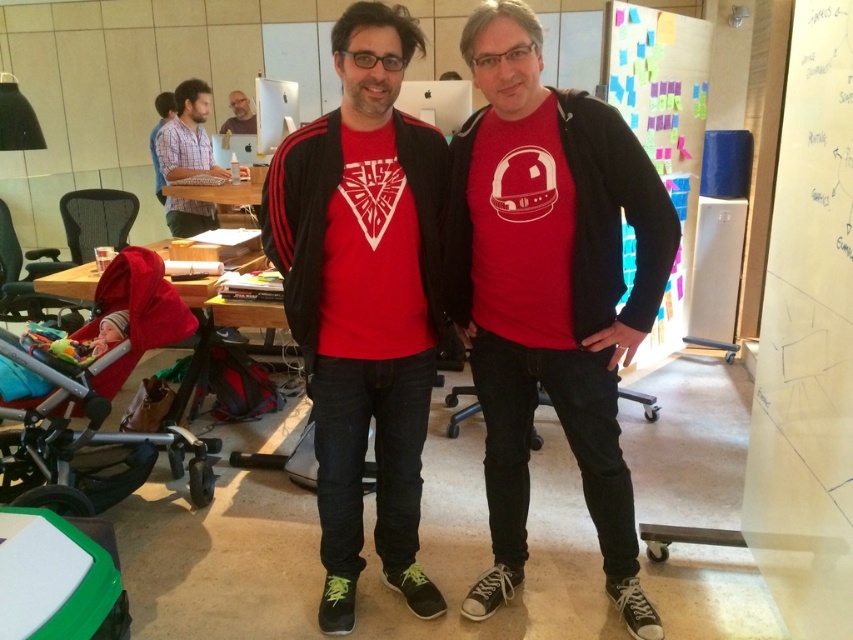
Question: Which point is closer to the camera taking this photo?

Choices:
 (A) (247, 106)
 (B) (331, 401)

Answer: (B)

Question: Is matte blue shirt at upper left below matte black laptop at upper left?

Choices:
 (A) yes
 (B) no

Answer: (A)

Question: Is matte blue shirt at upper left below matte black laptop at upper left?

Choices:
 (A) no
 (B) yes

Answer: (B)

Question: Can you confirm if matte blue shirt at upper left is wider than matte black laptop at upper left?

Choices:
 (A) no
 (B) yes

Answer: (B)

Question: Among these objects, which one is farthest from the camera?

Choices:
 (A) matte red t-shirt at center
 (B) matte blue shirt at upper left

Answer: (B)

Question: Which object is closer to the camera taking this photo?

Choices:
 (A) matte red t-shirt at center
 (B) matte blue shirt at upper left
 (C) matte black jacket at center
 (D) matte black laptop at upper left

Answer: (A)